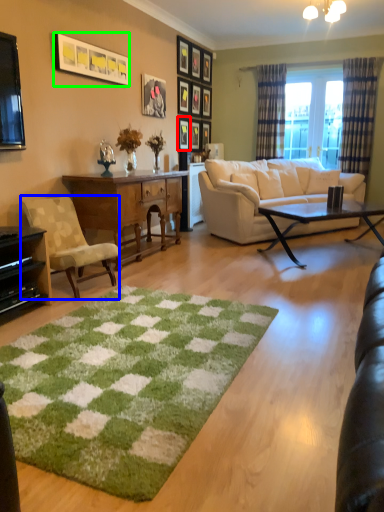
Question: Estimate the real-world distances between objects in this image. Which object is closer to picture frame (highlighted by a red box), chair (highlighted by a blue box) or picture frame (highlighted by a green box)?

Choices:
 (A) chair
 (B) picture frame

Answer: (B)